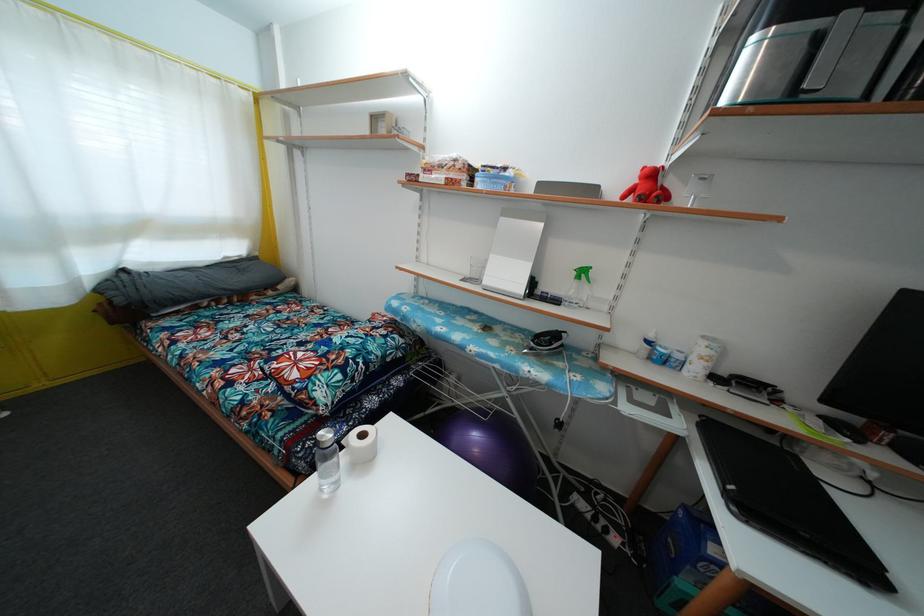
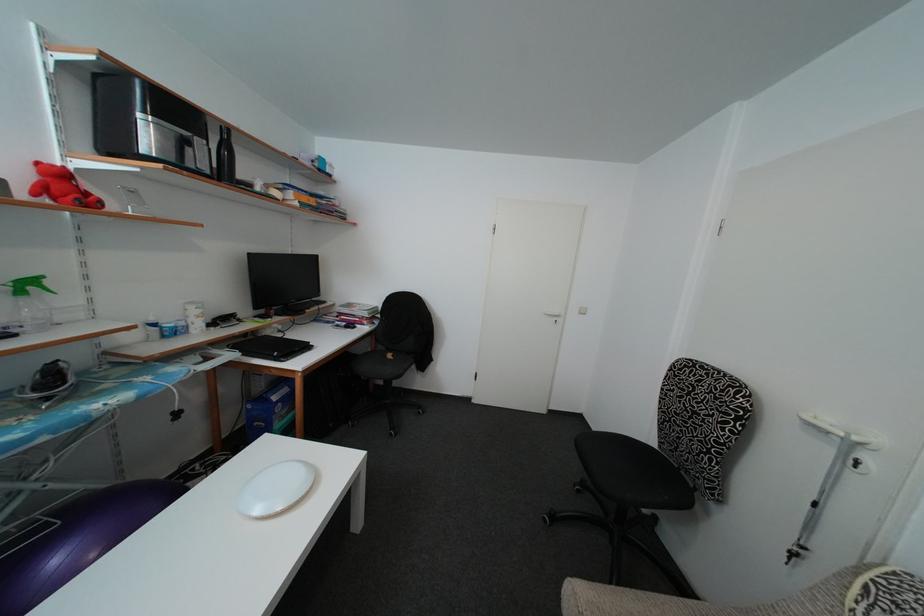
The images are taken continuously from a first-person perspective. In which direction is your viewpoint rotating?

The camera's rotation is toward right-down.